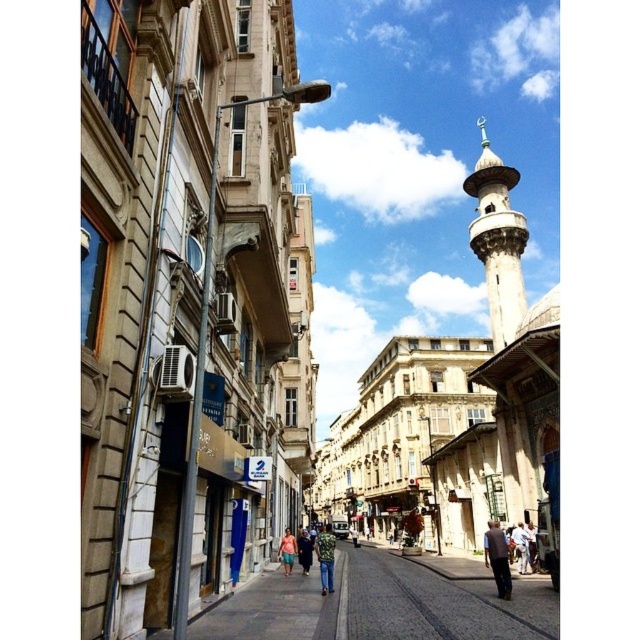
You are a photographer standing on the sidewalk of this historic street. You notice two people wearing denim pants at center and light pink fabric dress at center. Which clothing item is positioned lower on the person?

The denim pants at center is located below light pink fabric dress at center, so the denim pants at center is positioned lower on the person.

You are a photographer wanting to capture both the light blue jeans at center and the light pink fabric dress at center in a single frame. Since you want to emphasize the smaller item, which clothing item should you focus on to ensure it stands out?

The light blue jeans at center is smaller than the light pink fabric dress at center, so you should focus on the light blue jeans at center to emphasize its smaller size in the photograph.